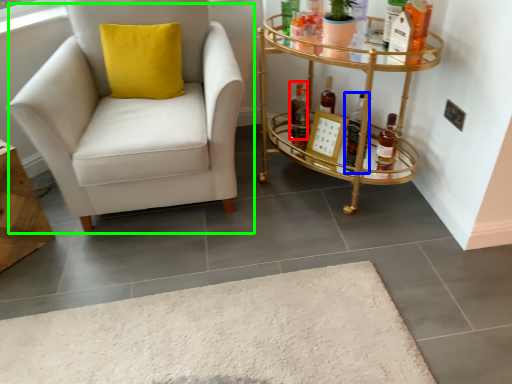
Question: Considering the real-world distances, which object is closest to bottle (highlighted by a red box)? bottle (highlighted by a blue box) or chair (highlighted by a green box).

Choices:
 (A) bottle
 (B) chair

Answer: (A)